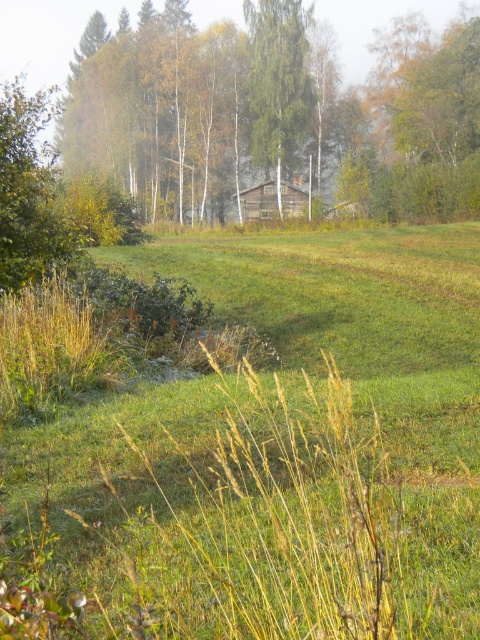
You are a hiker who wants to take a photo of the wooden cabin at center from the grassy field in front of it. However, you notice the white bark birch tree at center is blocking your view. Can you still get a clear shot of the cabin without moving from your current position?

The white bark birch tree at center is taller than the wooden cabin at center, so the tree might block part of the cabin. To get a clear shot, you might need to move to a different position where the tree isn

You are standing in the field and want to reach the wooden cabin at center. There is a white bark birch tree at center blocking your path. Can you walk around it to get to the cabin?

The white bark birch tree at center is positioned over wooden cabin at center, so you cannot walk around it because the tree is directly above the cabin, blocking all sides.

You are a painter who wants to capture the scene of the green wood house at center and the white bark birch tree at center. Which object should you focus on first if you want to paint the larger one first?

The green wood house at center is larger in size than the white bark birch tree at center, so you should focus on painting the green wood house at center first.